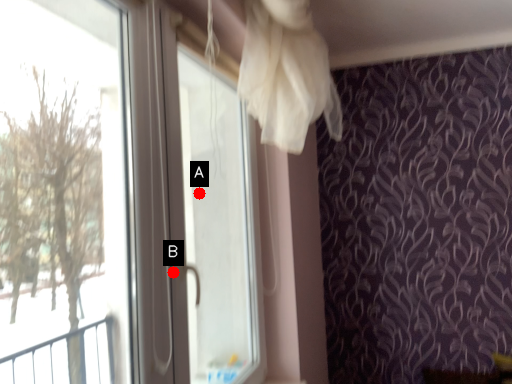
Question: Two points are circled on the image, labeled by A and B beside each circle. Which point is farther from the camera taking this photo?

Choices:
 (A) A is further
 (B) B is further

Answer: (A)